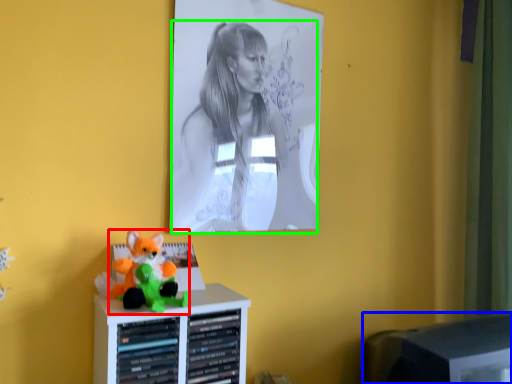
Question: Considering the real-world distances, which object is closest to toy (highlighted by a red box)? computer monitor (highlighted by a blue box) or person (highlighted by a green box).

Choices:
 (A) computer monitor
 (B) person

Answer: (B)